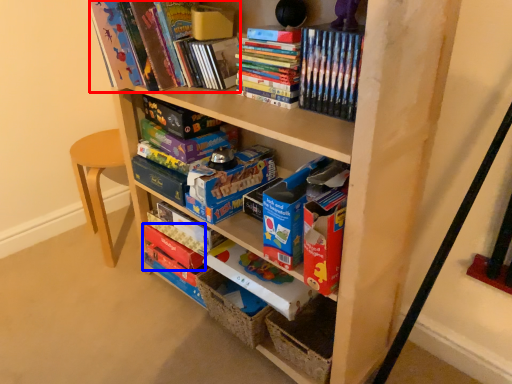
Question: Which object appears farthest to the camera in this image, book (highlighted by a red box) or paperback book (highlighted by a blue box)?

Choices:
 (A) book
 (B) paperback book

Answer: (B)